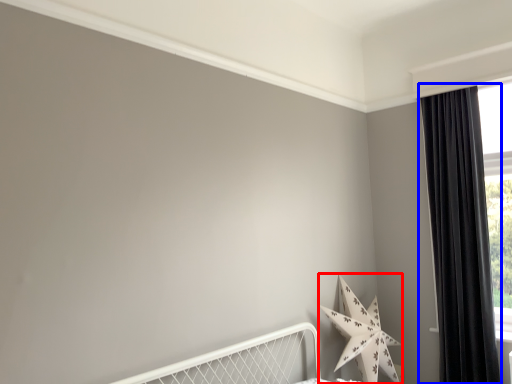
Question: Which object is further to the camera taking this photo, star (highlighted by a red box) or curtain (highlighted by a blue box)?

Choices:
 (A) star
 (B) curtain

Answer: (B)